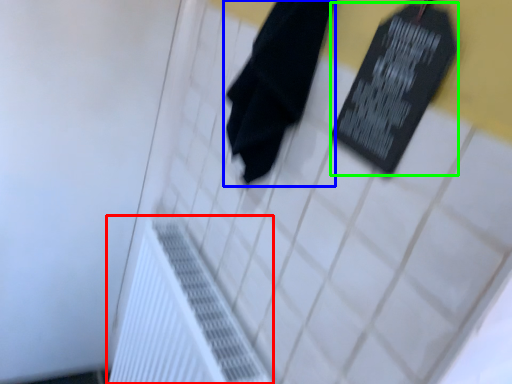
Question: Considering the real-world distances, which object is closest to radiator (highlighted by a red box)? towel (highlighted by a blue box) or bulletin board (highlighted by a green box).

Choices:
 (A) towel
 (B) bulletin board

Answer: (A)